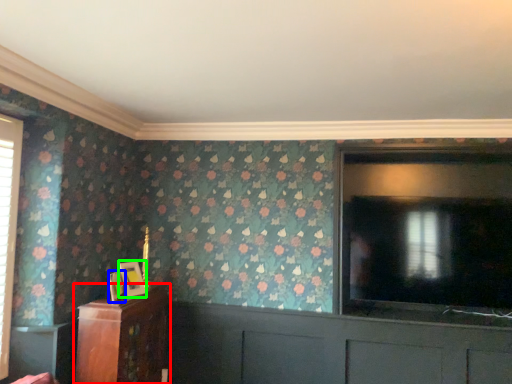
Question: Which is farther away from furniture (highlighted by a red box)? picture frame (highlighted by a blue box) or picture frame (highlighted by a green box)?

Choices:
 (A) picture frame
 (B) picture frame

Answer: (A)